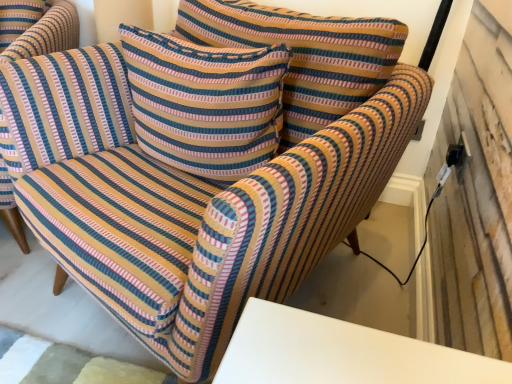
The width and height of the screenshot is (512, 384). Describe the element at coordinates (205, 103) in the screenshot. I see `striped fabric pillow at center` at that location.

The height and width of the screenshot is (384, 512). What are the coordinates of `striped fabric pillow at center` in the screenshot? It's located at (205, 103).

I want to click on striped fabric pillow at center, so click(x=205, y=103).